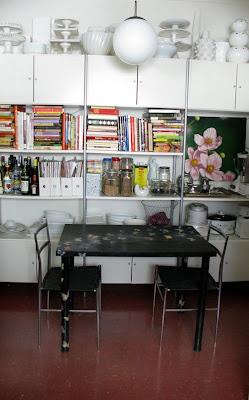
The width and height of the screenshot is (249, 400). What are the coordinates of `back of chairs` in the screenshot? It's located at (36, 231), (219, 230).